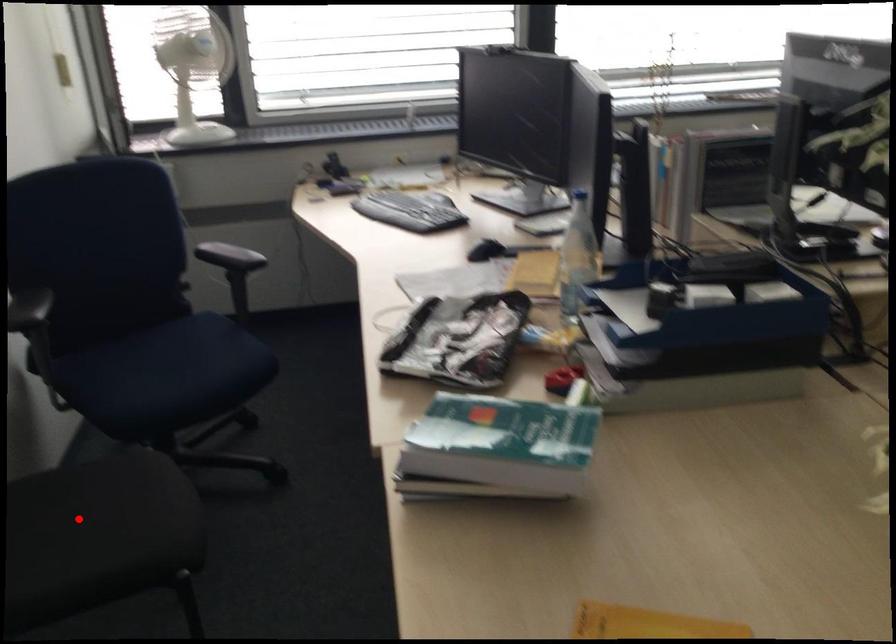
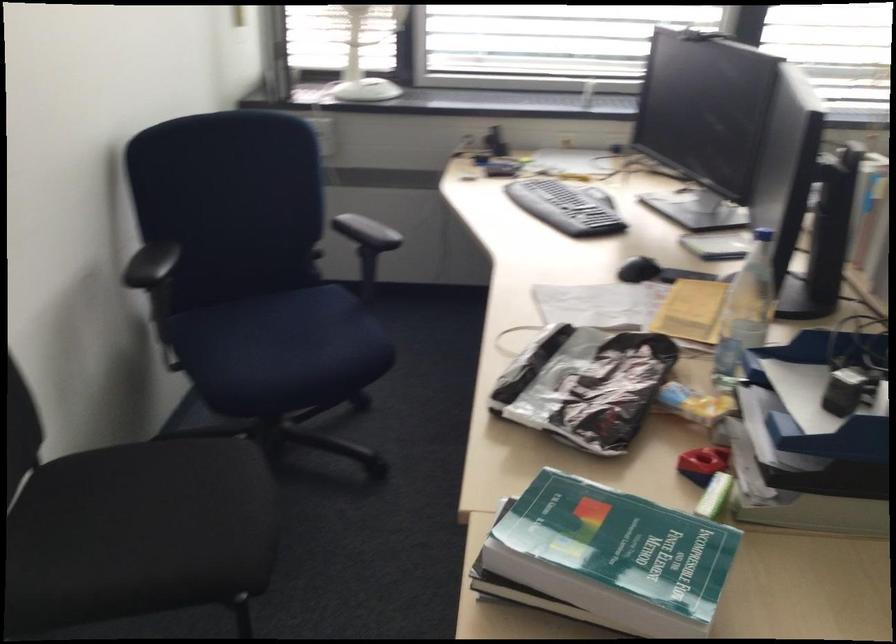
Where in the second image is the point corresponding to the highlighted location from the first image?

(157, 500)